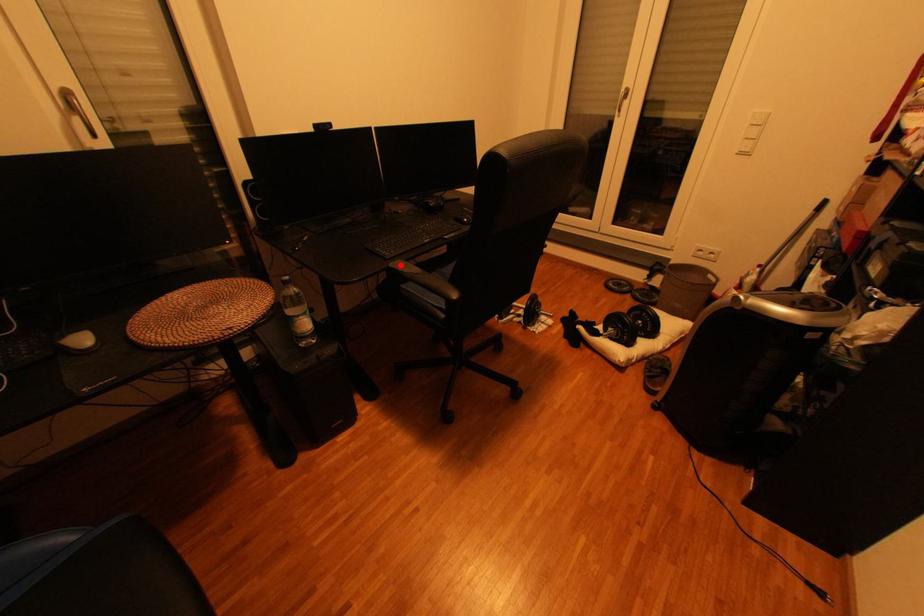
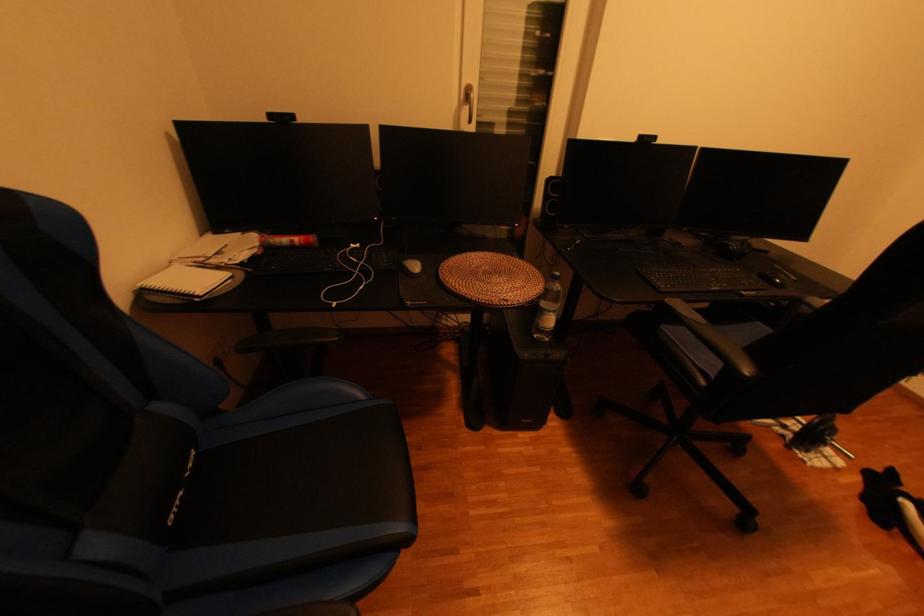
Where in the second image is the point corresponding to the highlighted location from the first image?

(677, 302)